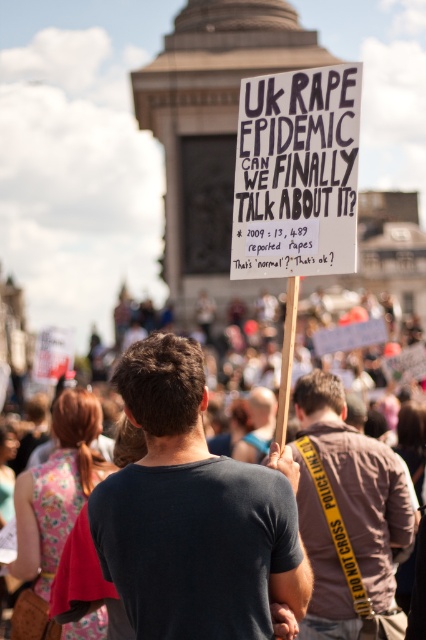
Does dark gray t-shirt at center have a greater height compared to brown leather jacket at center?

No.

Is point (154, 612) closer to viewer compared to point (379, 512)?

Yes, point (154, 612) is closer to viewer.

Is point (131, 392) in front of point (356, 442)?

That is True.

Find the location of `dark gray t-shirt at center`. dark gray t-shirt at center is located at coordinates [x=195, y=513].

Is the position of dark gray t-shirt at center less distant than that of white paper sign at center?

That is False.

Can you confirm if dark gray t-shirt at center is positioned below white paper sign at center?

Indeed, dark gray t-shirt at center is positioned under white paper sign at center.

Is point (163, 474) behind point (259, 244)?

No, (163, 474) is closer to viewer.

The image size is (426, 640). In order to click on dark gray t-shirt at center in this screenshot , I will do `click(195, 513)`.

Is white paper sign at center behind brown leather jacket at center?

No.

Which is above, white paper sign at center or brown leather jacket at center?

white paper sign at center is higher up.

What do you see at coordinates (296, 173) in the screenshot? The width and height of the screenshot is (426, 640). I see `white paper sign at center` at bounding box center [296, 173].

Locate an element on the screen. The height and width of the screenshot is (640, 426). white paper sign at center is located at coordinates (296, 173).